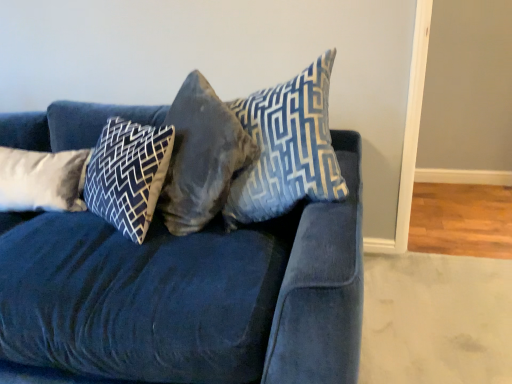
Question: Looking at their shapes, would you say white soft pillow at left, arranged as the first pillow when viewed from the left, is wider or thinner than velvet blue couch at center?

Choices:
 (A) wide
 (B) thin

Answer: (B)

Question: Is white soft pillow at left, arranged as the first pillow when viewed from the left, in front of or behind velvet blue couch at center in the image?

Choices:
 (A) behind
 (B) front

Answer: (A)

Question: Based on their relative distances, which object is farther from the white soft pillow at left, arranged as the first pillow when viewed from the left?

Choices:
 (A) velvet blue couch at center
 (B) velvet gray pillow at center, positioned as the 3th pillow in left-to-right order
 (C) blue velvet pillow at center, the 1th pillow positioned from the right
 (D) dark blue velvet pillow at center, which ranks as the 3th pillow in right-to-left order

Answer: (C)

Question: Which is farther from the velvet gray pillow at center, positioned as the 3th pillow in left-to-right order?

Choices:
 (A) dark blue velvet pillow at center, which ranks as the 3th pillow in right-to-left order
 (B) blue velvet pillow at center, which is counted as the fourth pillow, starting from the left
 (C) white soft pillow at left, arranged as the first pillow when viewed from the left
 (D) velvet blue couch at center

Answer: (C)